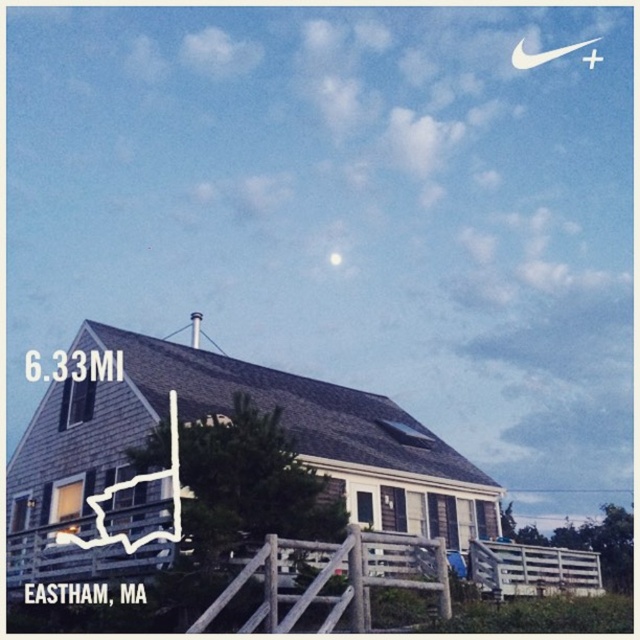
Can you confirm if white fabric crescent at upper right is positioned above bright silver moon at upper center?

Yes.

Is white fabric crescent at upper right wider than bright silver moon at upper center?

Yes, white fabric crescent at upper right is wider than bright silver moon at upper center.

Is point (513, 49) less distant than point (333, 256)?

No, (513, 49) is further to viewer.

You are a GUI agent. You are given a task and a screenshot of the screen. Output one action in this format:
    pyautogui.click(x=<x>, y=<y>)
    Task: Click on the white fabric crescent at upper right
    
    Given the screenshot: What is the action you would take?
    pyautogui.click(x=541, y=54)